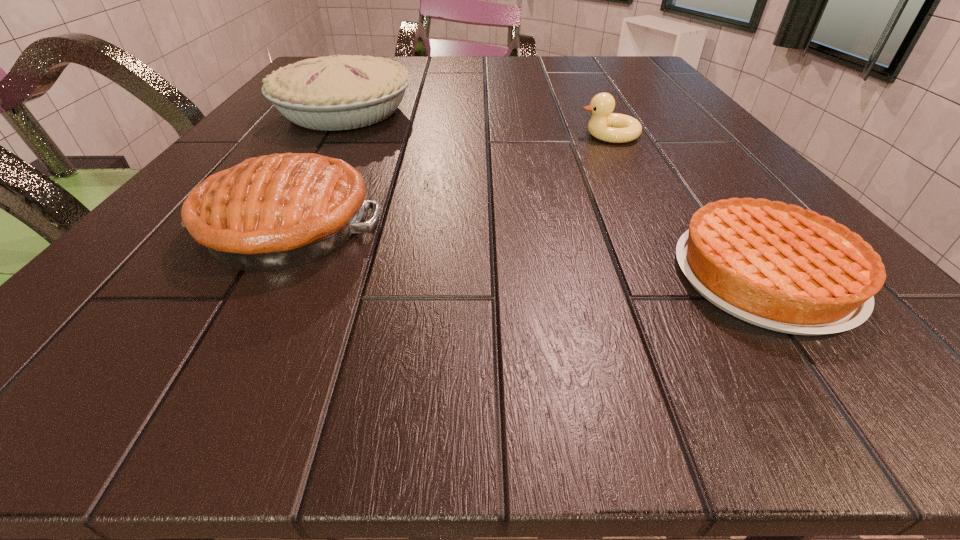
This screenshot has width=960, height=540. I want to click on the farthest pie, so click(341, 92).

Locate an element on the screen. Image resolution: width=960 pixels, height=540 pixels. the third tallest object is located at coordinates (604, 125).

You are a GUI agent. You are given a task and a screenshot of the screen. Output one action in this format:
    pyautogui.click(x=<x>, y=<y>)
    Task: Click on the shortest pie
    
    Given the screenshot: What is the action you would take?
    pyautogui.click(x=780, y=267)

This screenshot has width=960, height=540. Find the location of `the rightmost pie`. the rightmost pie is located at coordinates (780, 267).

Identify the location of free location located on the right of the farthest pie. Image resolution: width=960 pixels, height=540 pixels. [475, 112].

The width and height of the screenshot is (960, 540). What are the coordinates of `vacant area situated 0.150m at the beak of the duckling` in the screenshot? It's located at (501, 134).

Locate an element on the screen. Image resolution: width=960 pixels, height=540 pixels. vacant area situated at the beak of the duckling is located at coordinates (538, 134).

The width and height of the screenshot is (960, 540). I want to click on vacant space located at the beak of the duckling, so click(543, 134).

Where is `vacant space located on the left of the rightmost pie`? This screenshot has height=540, width=960. vacant space located on the left of the rightmost pie is located at coordinates (503, 275).

This screenshot has width=960, height=540. I want to click on object that is at the near edge, so click(780, 267).